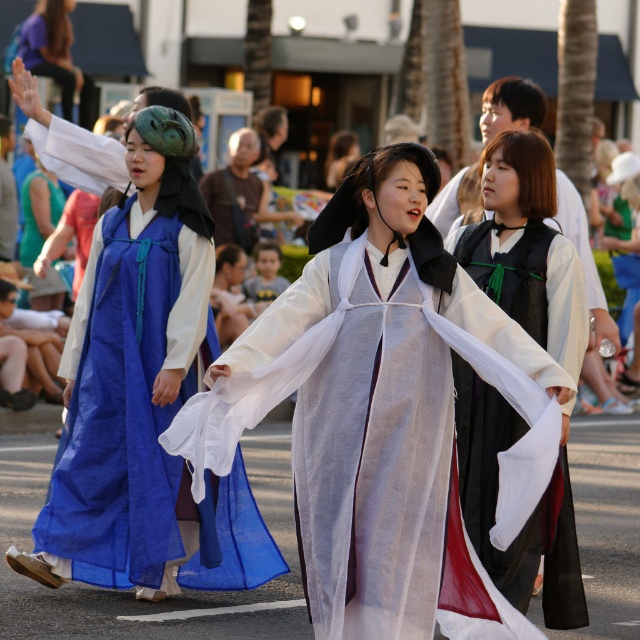
You are a photographer trying to capture a clear shot of the silky white robe at center and the blue silk dress at center. Which of the two is closer to the camera?

The silky white robe at center is positioned under the blue silk dress at center, meaning it is closer to the camera.

You are standing at the point with coordinates point (284, 285) and want to move to the point with coordinates point (516, 269). Is the destination point in front of or behind you?

The destination point point (516, 269) is in front of point (284, 285), so it is in front of you.